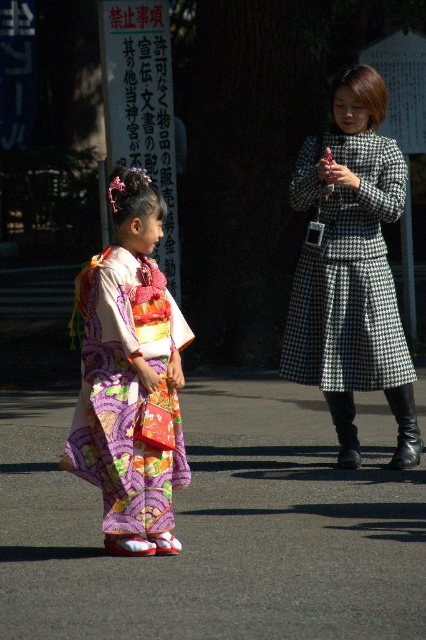
Question: Can you confirm if houndstooth wool coat at center is positioned to the right of multicolored silk kimono at left?

Choices:
 (A) yes
 (B) no

Answer: (A)

Question: Which point is closer to the camera?

Choices:
 (A) multicolored silk kimono at left
 (B) houndstooth wool coat at center

Answer: (A)

Question: Is houndstooth wool coat at center in front of multicolored silk kimono at left?

Choices:
 (A) yes
 (B) no

Answer: (B)

Question: Which point is closer to the camera taking this photo?

Choices:
 (A) (123, 372)
 (B) (400, 157)

Answer: (A)

Question: Is houndstooth wool coat at center to the right of multicolored silk kimono at left from the viewer's perspective?

Choices:
 (A) no
 (B) yes

Answer: (B)